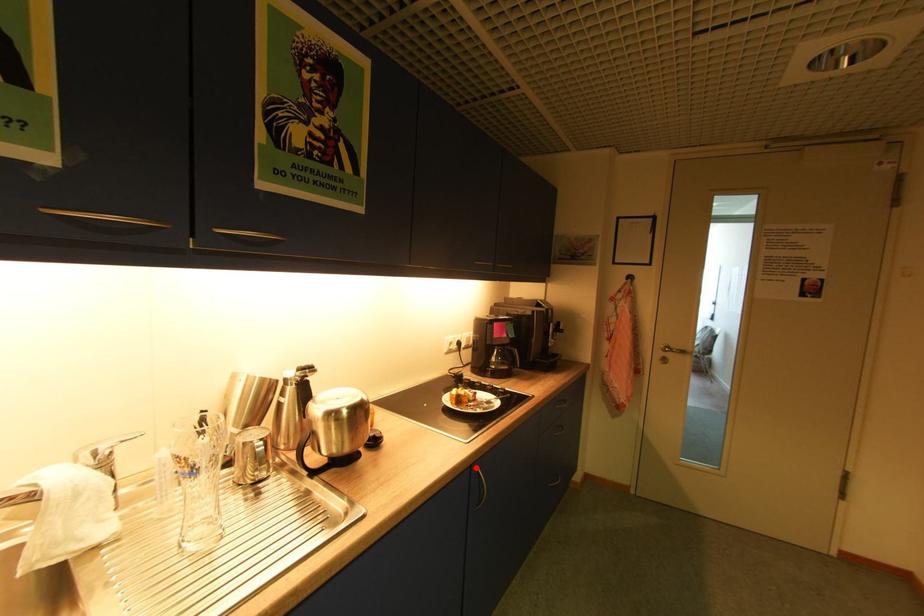
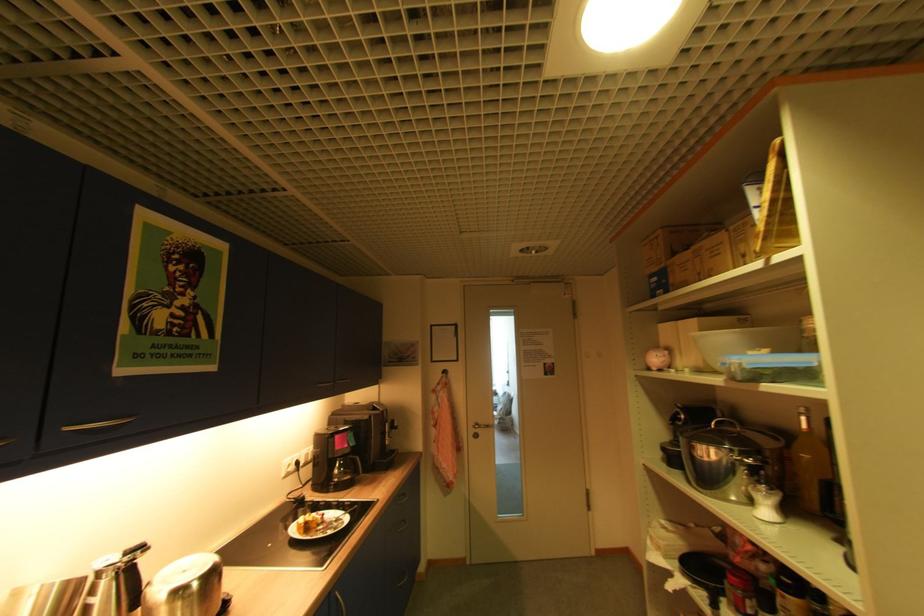
Where in the second image is the point corresponding to the highlighted location from the first image?

(335, 593)